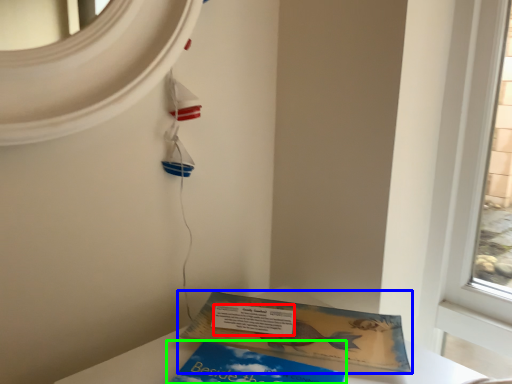
Question: Considering the real-world distances, which object is closest to writing (highlighted by a red box)? book (highlighted by a blue box) or book (highlighted by a green box).

Choices:
 (A) book
 (B) book

Answer: (A)